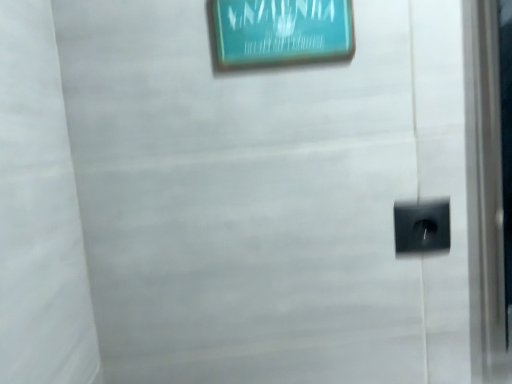
What do you see at coordinates (422, 226) in the screenshot?
I see `black plastic electric outlet at lower right` at bounding box center [422, 226].

The image size is (512, 384). I want to click on black plastic electric outlet at lower right, so click(422, 226).

This screenshot has width=512, height=384. Describe the element at coordinates (282, 31) in the screenshot. I see `teal glossy picture frame at upper center` at that location.

What is the approximate height of teal glossy picture frame at upper center?

11.37 centimeters.

Identify the location of teal glossy picture frame at upper center. Image resolution: width=512 pixels, height=384 pixels. (282, 31).

Locate an element on the screen. The width and height of the screenshot is (512, 384). black plastic electric outlet at lower right is located at coordinates (422, 226).

Based on their positions, is black plastic electric outlet at lower right located to the left or right of teal glossy picture frame at upper center?

In the image, black plastic electric outlet at lower right appears on the right side of teal glossy picture frame at upper center.

Which is in front, black plastic electric outlet at lower right or teal glossy picture frame at upper center?

teal glossy picture frame at upper center is closer to the camera.

Considering the points (436, 222) and (246, 66), which point is behind, point (436, 222) or point (246, 66)?

Positioned behind is point (436, 222).

From the image's perspective, which one is positioned lower, black plastic electric outlet at lower right or teal glossy picture frame at upper center?

black plastic electric outlet at lower right, from the image's perspective.

Based on the photo, from a real-world perspective, does black plastic electric outlet at lower right stand above teal glossy picture frame at upper center?

Incorrect, from a real-world perspective, black plastic electric outlet at lower right is lower than teal glossy picture frame at upper center.

Based on the photo, which object is thinner, black plastic electric outlet at lower right or teal glossy picture frame at upper center?

black plastic electric outlet at lower right is thinner.

Which of these two, black plastic electric outlet at lower right or teal glossy picture frame at upper center, stands shorter?

black plastic electric outlet at lower right.

Considering the relative sizes of black plastic electric outlet at lower right and teal glossy picture frame at upper center in the image provided, is black plastic electric outlet at lower right smaller than teal glossy picture frame at upper center?

Yes.

Is teal glossy picture frame at upper center surrounded by black plastic electric outlet at lower right?

Actually, teal glossy picture frame at upper center is outside black plastic electric outlet at lower right.

Is black plastic electric outlet at lower right next to teal glossy picture frame at upper center?

black plastic electric outlet at lower right is not next to teal glossy picture frame at upper center, and they're not touching.

Is black plastic electric outlet at lower right facing away from teal glossy picture frame at upper center?

black plastic electric outlet at lower right is not turned away from teal glossy picture frame at upper center.

Can you tell me how much black plastic electric outlet at lower right and teal glossy picture frame at upper center differ in facing direction?

The angular difference between black plastic electric outlet at lower right and teal glossy picture frame at upper center is 0.113 degrees.

How far apart are black plastic electric outlet at lower right and teal glossy picture frame at upper center?

11.93 inches.

Locate an element on the screen. This screenshot has height=384, width=512. picture frame on the left of black plastic electric outlet at lower right is located at coordinates (282, 31).

Can you confirm if teal glossy picture frame at upper center is positioned to the right of black plastic electric outlet at lower right?

In fact, teal glossy picture frame at upper center is to the left of black plastic electric outlet at lower right.

Is teal glossy picture frame at upper center closer to camera compared to black plastic electric outlet at lower right?

Yes, teal glossy picture frame at upper center is in front of black plastic electric outlet at lower right.

Is point (276, 25) farther from viewer compared to point (436, 224)?

That is False.

From the image's perspective, is teal glossy picture frame at upper center on black plastic electric outlet at lower right?

Yes, from the image's perspective, teal glossy picture frame at upper center is over black plastic electric outlet at lower right.

From a real-world perspective, between teal glossy picture frame at upper center and black plastic electric outlet at lower right, who is vertically higher?

From a 3D spatial view, teal glossy picture frame at upper center is above.

Is teal glossy picture frame at upper center wider than black plastic electric outlet at lower right?

Correct, the width of teal glossy picture frame at upper center exceeds that of black plastic electric outlet at lower right.

Which of these two, teal glossy picture frame at upper center or black plastic electric outlet at lower right, stands shorter?

black plastic electric outlet at lower right is shorter.

Looking at the image, does teal glossy picture frame at upper center seem bigger or smaller compared to black plastic electric outlet at lower right?

Considering their sizes, teal glossy picture frame at upper center takes up more space than black plastic electric outlet at lower right.

Is black plastic electric outlet at lower right surrounded by teal glossy picture frame at upper center?

No, black plastic electric outlet at lower right is not a part of teal glossy picture frame at upper center.

Is teal glossy picture frame at upper center far from black plastic electric outlet at lower right?

They are positioned close to each other.

Is black plastic electric outlet at lower right at the back of teal glossy picture frame at upper center?

No, black plastic electric outlet at lower right is not at the back of teal glossy picture frame at upper center.

What's the angular difference between teal glossy picture frame at upper center and black plastic electric outlet at lower right's facing directions?

They differ by 0.113 degrees in their facing directions.

Measure the distance from teal glossy picture frame at upper center to black plastic electric outlet at lower right.

teal glossy picture frame at upper center is 11.93 inches away from black plastic electric outlet at lower right.

Identify the location of electric outlet lying behind the teal glossy picture frame at upper center. (422, 226).

I want to click on electric outlet that appears behind the teal glossy picture frame at upper center, so click(x=422, y=226).

This screenshot has height=384, width=512. Identify the location of picture frame in front of the black plastic electric outlet at lower right. (282, 31).